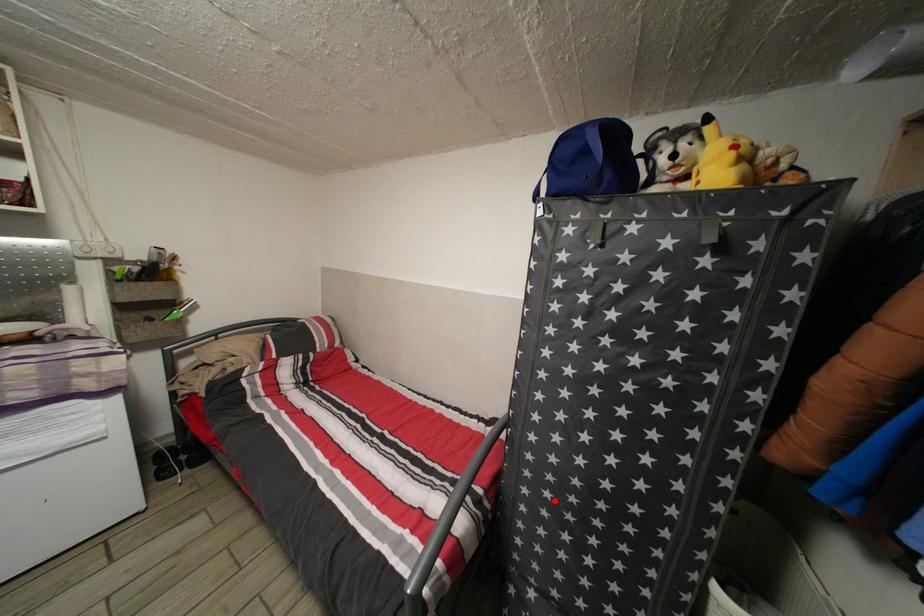
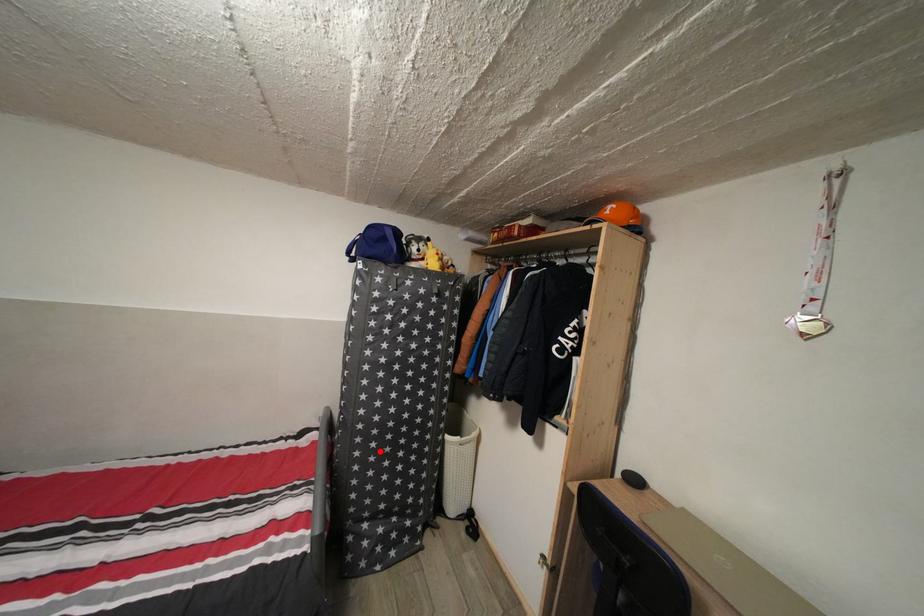
I am providing you with two images of the same scene from different viewpoints. A red point is marked on the first image and another point is marked on the second image. Are the points marked in image1 and image2 representing the same 3D position?

Yes